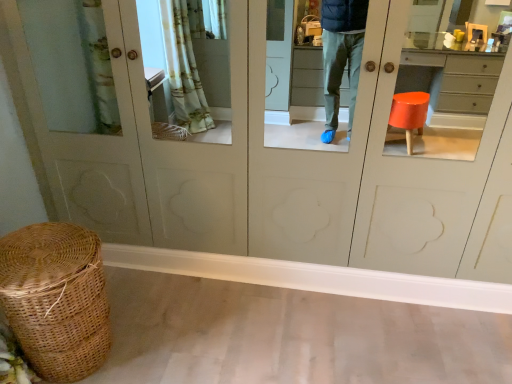
I want to click on vacant space behind woven brown basket at lower left, so click(136, 292).